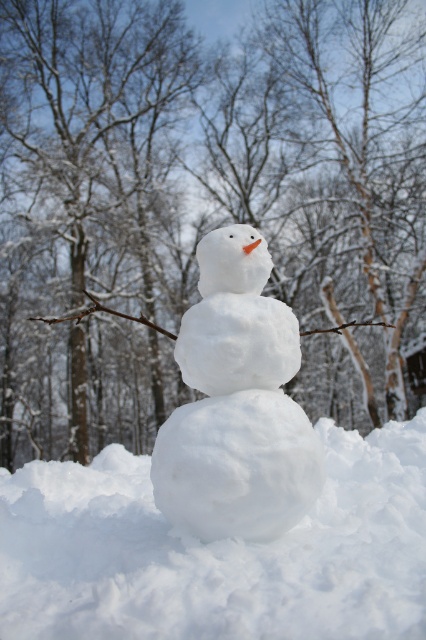
You are standing in the snowy landscape looking at the snowman. There are two points marked in the image. Which point is closer to you, point (169, 19) or point (271, 310)?

Point (169, 19) is closer to you because it is further to the viewer than point (271, 310).